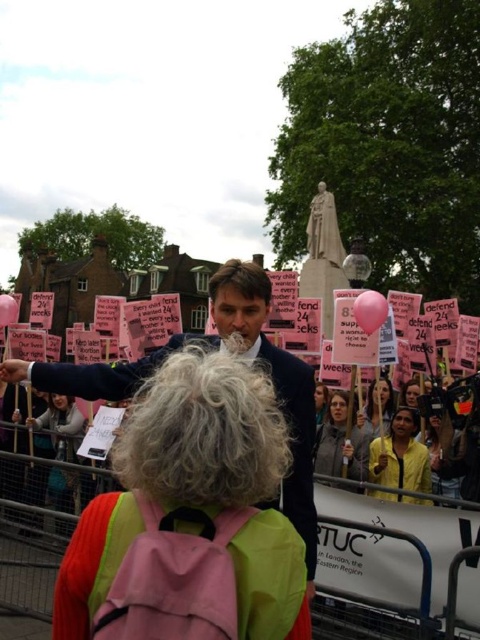
Does yellow matte jacket at lower center have a larger size compared to smooth yellow jacket at center?

Indeed, yellow matte jacket at lower center has a larger size compared to smooth yellow jacket at center.

Is yellow matte jacket at lower center in front of smooth yellow jacket at center?

Yes, yellow matte jacket at lower center is in front of smooth yellow jacket at center.

Describe the element at coordinates (400, 456) in the screenshot. The image size is (480, 640). I see `yellow matte jacket at lower center` at that location.

Image resolution: width=480 pixels, height=640 pixels. I want to click on yellow matte jacket at lower center, so click(x=400, y=456).

From the picture: Between light brown hair at center and smooth pink balloon at center, which one has less height?

With less height is smooth pink balloon at center.

Is light brown hair at center positioned in front of smooth pink balloon at center?

That is False.

In order to click on light brown hair at center in this screenshot , I will do `click(61, 426)`.

You are a GUI agent. You are given a task and a screenshot of the screen. Output one action in this format:
    pyautogui.click(x=<x>, y=<y>)
    Task: Click on the light brown hair at center
    
    Given the screenshot: What is the action you would take?
    pyautogui.click(x=61, y=426)

Based on the photo, is smooth pink balloon at center above smooth black hair at center?

Yes.

Is smooth pink balloon at center positioned before smooth black hair at center?

No, smooth pink balloon at center is further to the viewer.

Does point (376, 403) lie in front of point (321, 419)?

Yes.

Image resolution: width=480 pixels, height=640 pixels. I want to click on smooth pink balloon at center, so click(376, 406).